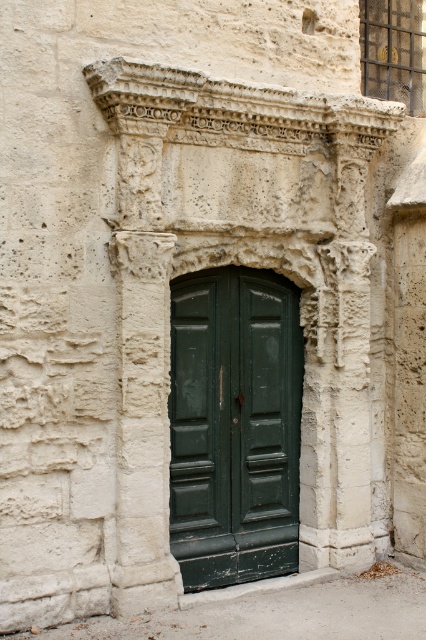
Question: Does carved stone arch at center lie behind green wooden door at center?

Choices:
 (A) no
 (B) yes

Answer: (A)

Question: Can you confirm if carved stone arch at center is wider than green wooden door at center?

Choices:
 (A) yes
 (B) no

Answer: (A)

Question: Can you confirm if carved stone arch at center is positioned below green wooden door at center?

Choices:
 (A) no
 (B) yes

Answer: (A)

Question: Which of the following is the farthest from the observer?

Choices:
 (A) (340, 212)
 (B) (244, 525)

Answer: (B)

Question: Which point appears closest to the camera in this image?

Choices:
 (A) (334, 540)
 (B) (238, 394)

Answer: (B)